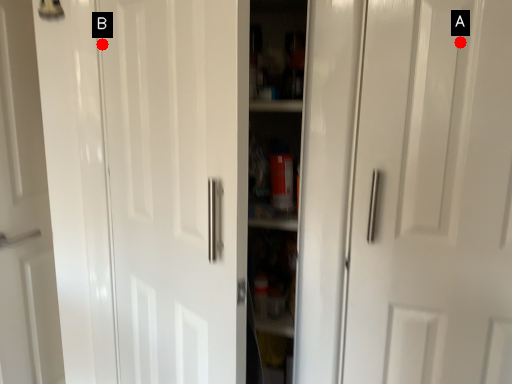
Question: Two points are circled on the image, labeled by A and B beside each circle. Which point is closer to the camera taking this photo?

Choices:
 (A) A is closer
 (B) B is closer

Answer: (A)